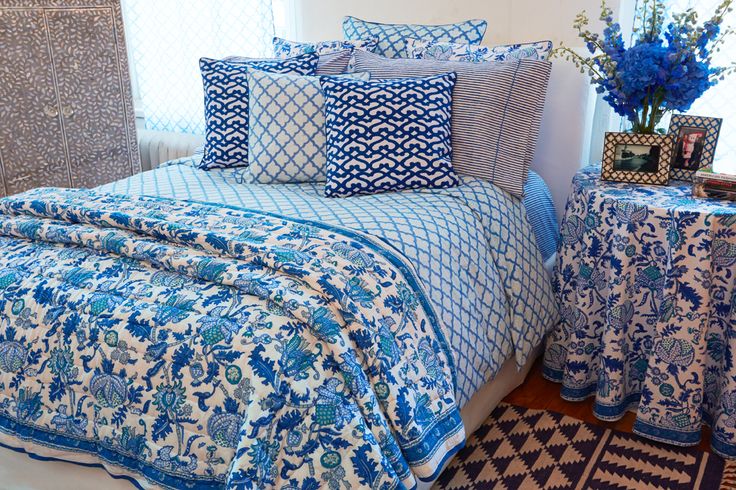
I want to click on books, so click(718, 187).